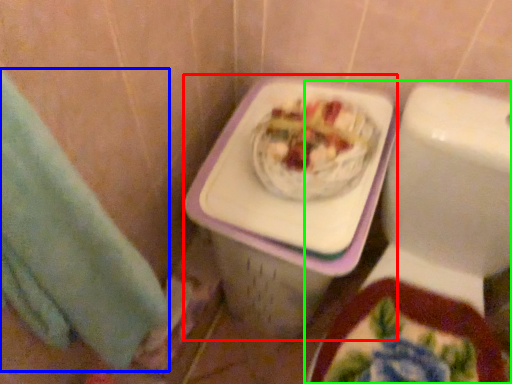
Question: Which object is positioned farthest from porcelain (highlighted by a red box)? Select from hand towel (highlighted by a blue box) and toilet (highlighted by a green box).

Choices:
 (A) hand towel
 (B) toilet

Answer: (A)